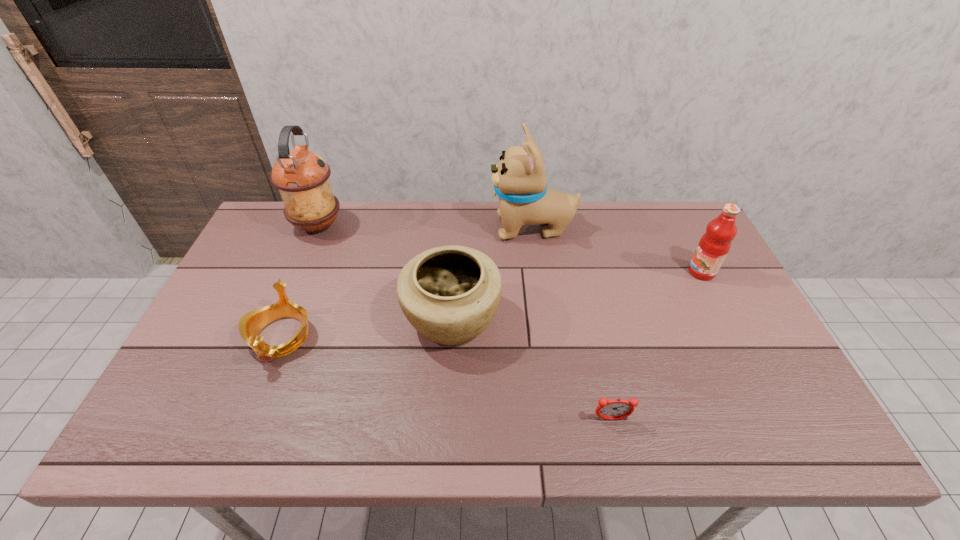
Image resolution: width=960 pixels, height=540 pixels. Find the location of `vacant point that satisfies the following two spatial constraints: 1. on the face of the puppy; 2. on the front side of the pottery`. vacant point that satisfies the following two spatial constraints: 1. on the face of the puppy; 2. on the front side of the pottery is located at coordinates (544, 319).